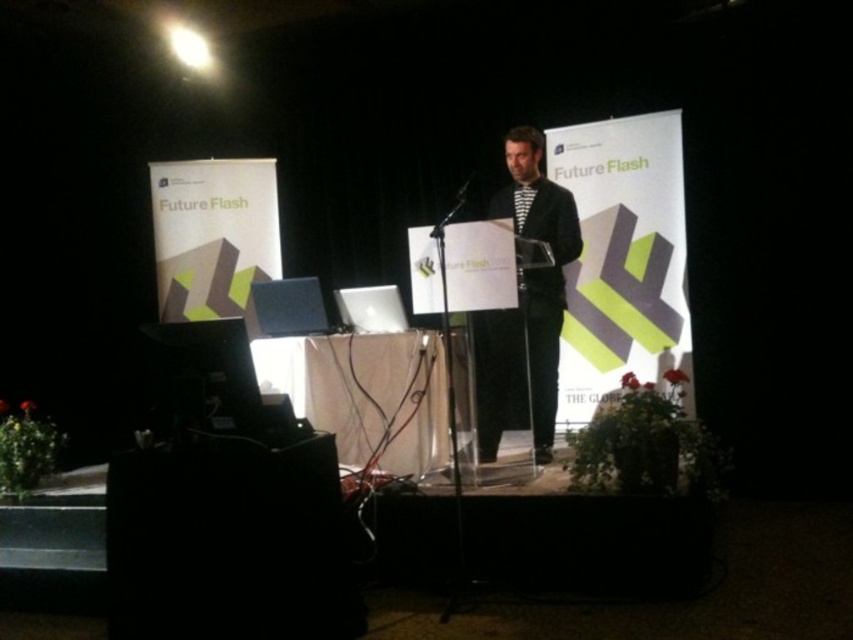
Question: Is black plastic speaker at lower left above transparent plastic microphone at center?

Choices:
 (A) no
 (B) yes

Answer: (A)

Question: Which object is farther from the camera taking this photo?

Choices:
 (A) striped fabric shirt at center
 (B) transparent plastic microphone at center
 (C) black plastic speaker at lower left

Answer: (B)

Question: Estimate the real-world distances between objects in this image. Which object is farther from the striped fabric shirt at center?

Choices:
 (A) black plastic speaker at lower left
 (B) transparent plastic microphone at center

Answer: (B)

Question: Can you confirm if black plastic speaker at lower left is positioned to the left of striped fabric shirt at center?

Choices:
 (A) no
 (B) yes

Answer: (B)

Question: Estimate the real-world distances between objects in this image. Which object is closer to the transparent plastic microphone at center?

Choices:
 (A) black plastic speaker at lower left
 (B) striped fabric shirt at center

Answer: (B)

Question: Is black plastic speaker at lower left closer to the viewer compared to transparent plastic microphone at center?

Choices:
 (A) yes
 (B) no

Answer: (A)